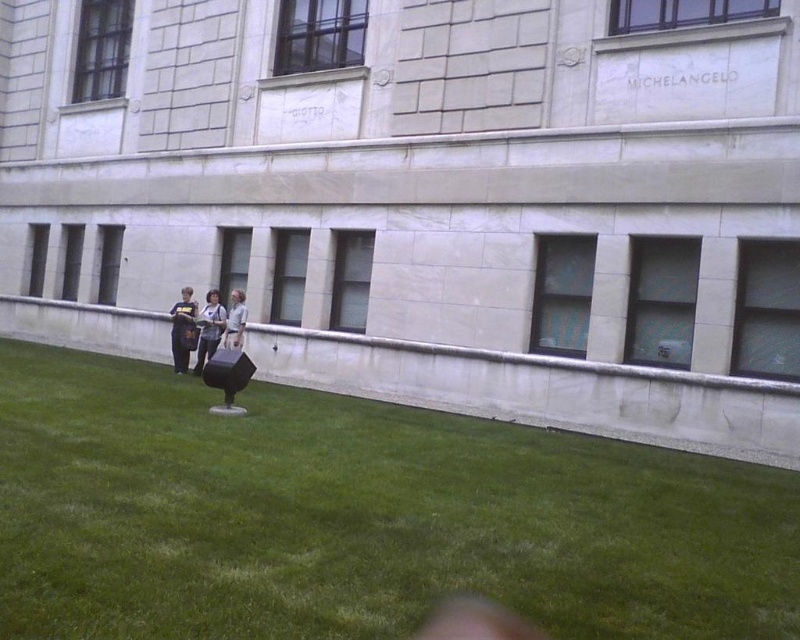
You are a photographer standing in front of the building. You notice a dark blue shirt at center and a dark gray fabric jacket at center. Which clothing item appears taller in the image?

The dark blue shirt at center is taller than the dark gray fabric jacket at center.

You are a photographer setting up for an event at the building. You notice two shirts hanging on a rack in front of the building. The shirts are the dark blue shirt at center and the light gray shirt at center. Which shirt should you choose if you want the one that is wider?

The dark blue shirt at center is wider than the light gray shirt at center, so you should choose the dark blue shirt at center.